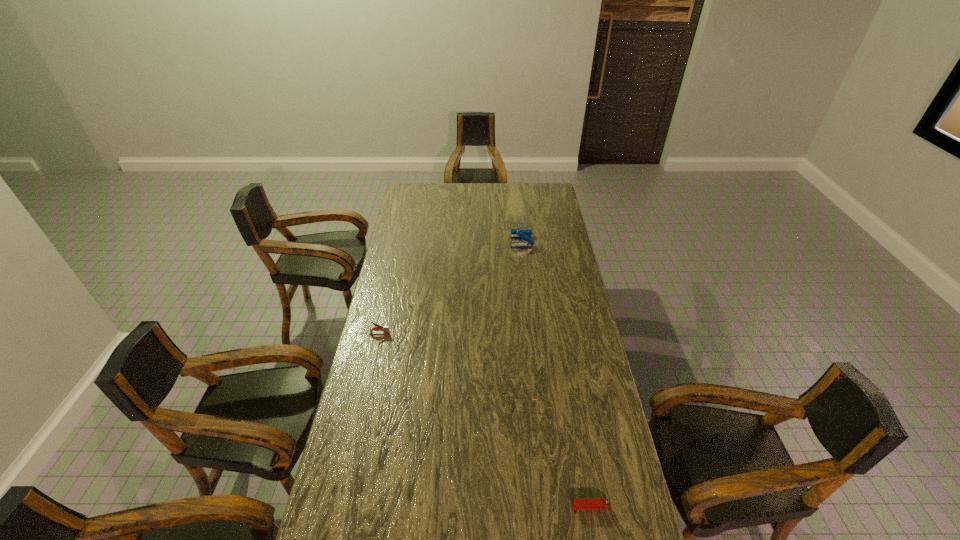
Locate an element on the screen. unoccupied area between the second nearest stapler and the tallest object is located at coordinates (450, 287).

The width and height of the screenshot is (960, 540). I want to click on empty space between the second farthest stapler and the spectacles, so click(450, 360).

At what (x,y) coordinates should I click in order to perform the action: click on object that is the closest one to the second shortest object. Please return your answer as a coordinate pair (x, y). Image resolution: width=960 pixels, height=540 pixels. Looking at the image, I should click on (585, 503).

This screenshot has height=540, width=960. What are the coordinates of `object that stands as the third closest to the leftmost object` in the screenshot? It's located at point(585,503).

Locate an element on the screen. stapler that is the second closest one to the shortest stapler is located at coordinates (525, 234).

Identify the location of stapler that is the closest one to the shortest stapler. The height and width of the screenshot is (540, 960). (385, 329).

This screenshot has width=960, height=540. I want to click on free space that satisfies the following two spatial constraints: 1. on the front side of the tallest stapler; 2. on the handle side of the second nearest stapler, so click(x=533, y=334).

Where is `free location that satisfies the following two spatial constraints: 1. on the front side of the tallest object; 2. on the temples of the spectacles`? free location that satisfies the following two spatial constraints: 1. on the front side of the tallest object; 2. on the temples of the spectacles is located at coordinates coord(539,386).